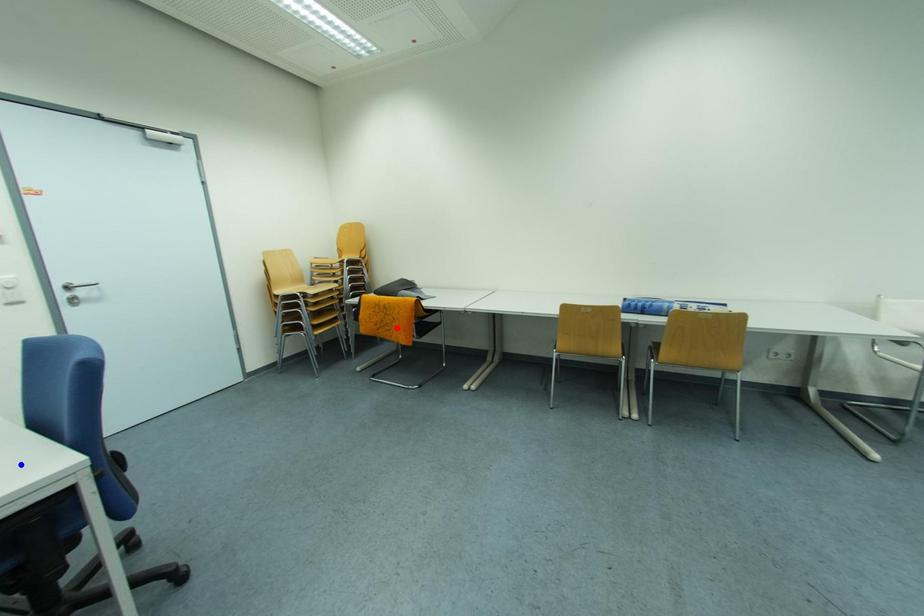
Question: Which of the two points in the image is closer to the camera?

Choices:
 (A) Blue point is closer.
 (B) Red point is closer.

Answer: (A)